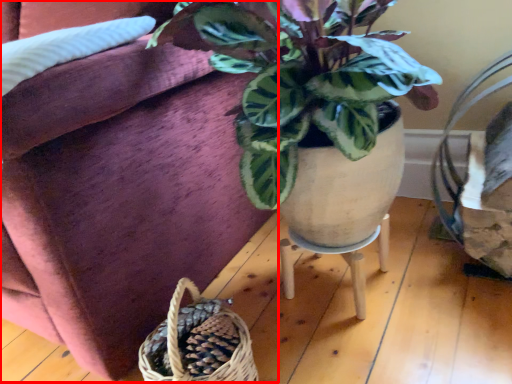
Question: From the image's perspective, where is couch (annotated by the red box) located relative to table?

Choices:
 (A) below
 (B) above

Answer: (B)